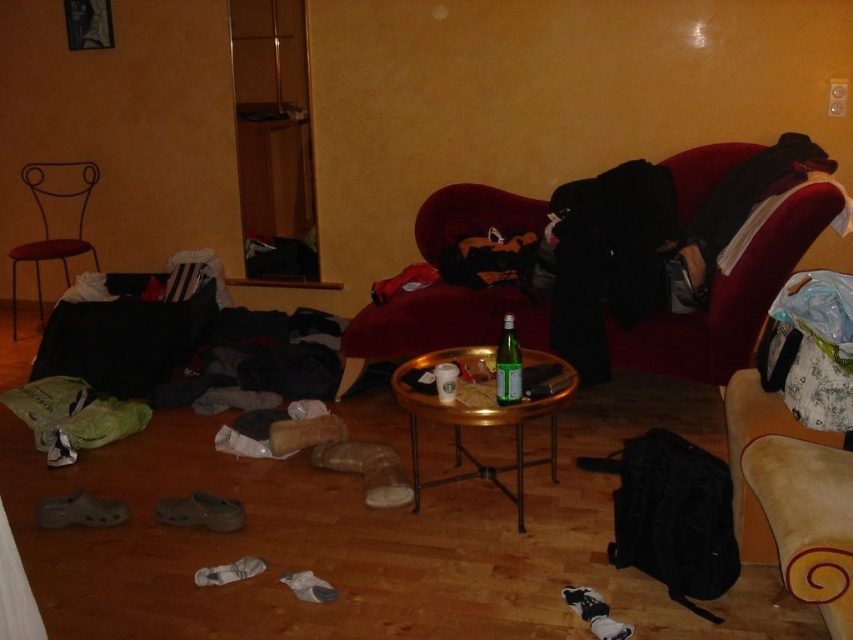
Is point (543, 356) farther from camera compared to point (520, 358)?

That is True.

Where is `gold metallic table at center`? The width and height of the screenshot is (853, 640). gold metallic table at center is located at coordinates (482, 419).

Who is more forward, (555, 428) or (518, 397)?

Point (518, 397)

The image size is (853, 640). I want to click on gold metallic table at center, so click(482, 419).

Based on the photo, can you confirm if gold metallic table at center is positioned above metallic red chair at left?

Incorrect, gold metallic table at center is not positioned above metallic red chair at left.

Identify the location of gold metallic table at center. (482, 419).

Identify the location of gold metallic table at center. The width and height of the screenshot is (853, 640). (482, 419).

Between metallic red chair at left and green glass bottle at center, which one is positioned higher?

metallic red chair at left

Is point (49, 192) positioned before point (520, 358)?

No, (49, 192) is behind (520, 358).

Between point (80, 248) and point (502, 368), which one is positioned behind?

The point (80, 248) is more distant.

Find the location of a particular element. The width and height of the screenshot is (853, 640). metallic red chair at left is located at coordinates pos(48,228).